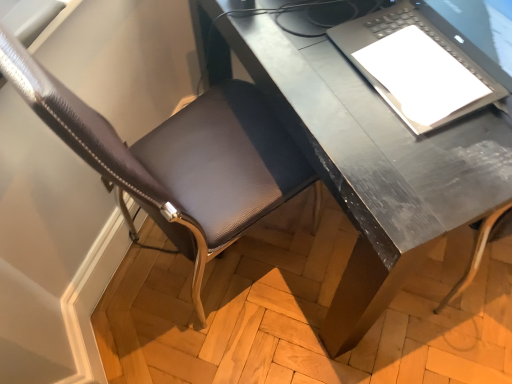
The image size is (512, 384). I want to click on free point in front of leather-like brown chair at lower left, so click(234, 339).